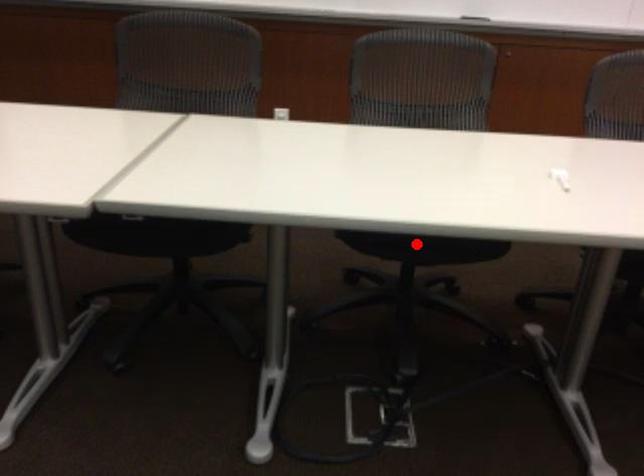
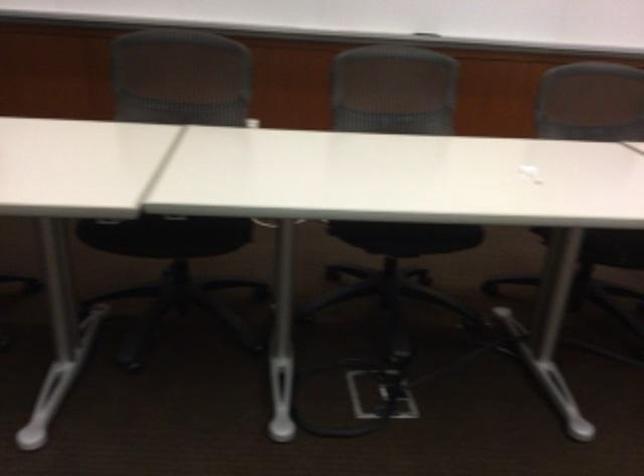
The point at the highlighted location is marked in the first image. Where is the corresponding point in the second image?

(406, 237)